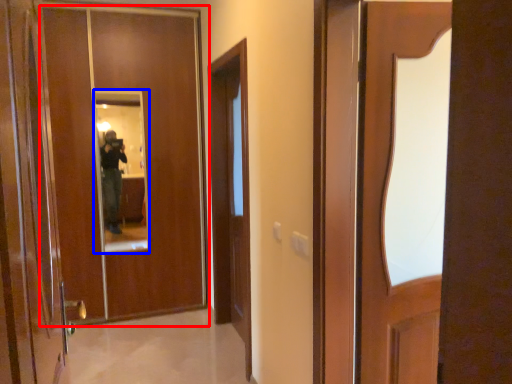
Question: Which of the following is the farthest to the observer, door (highlighted by a red box) or mirror (highlighted by a blue box)?

Choices:
 (A) door
 (B) mirror

Answer: (B)